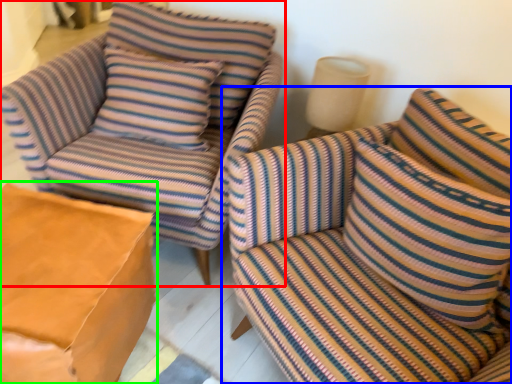
Question: Which object is the farthest from chair (highlighted by a red box)? Choose among these: studio couch (highlighted by a blue box) or table (highlighted by a green box).

Choices:
 (A) studio couch
 (B) table

Answer: (A)